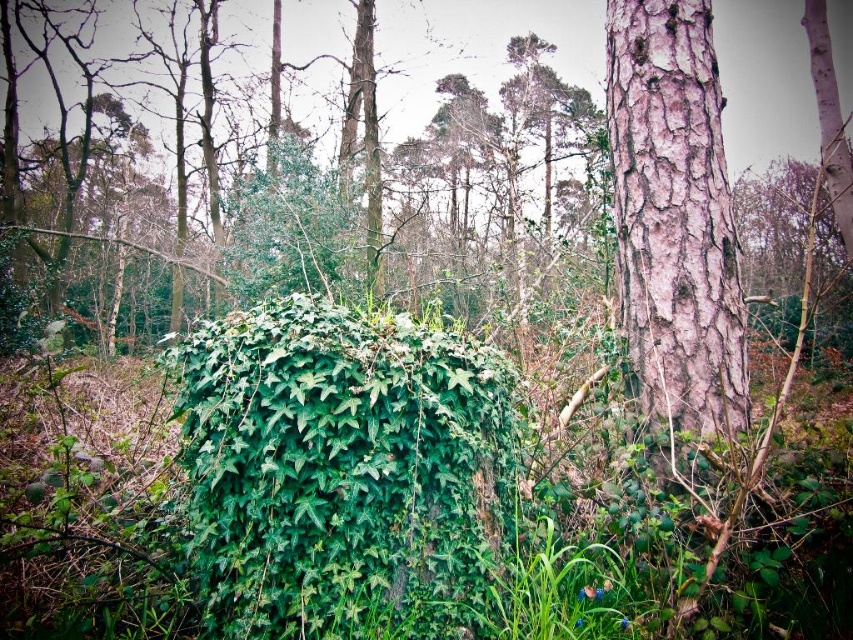
Describe the element at coordinates (343, 472) in the screenshot. I see `green leafy bush at center` at that location.

Is green leafy bush at center bigger than smooth pink bark at right?

Actually, green leafy bush at center might be smaller than smooth pink bark at right.

Describe the element at coordinates (343, 472) in the screenshot. I see `green leafy bush at center` at that location.

Find the location of a particular element. Image resolution: width=853 pixels, height=640 pixels. green leafy bush at center is located at coordinates (343, 472).